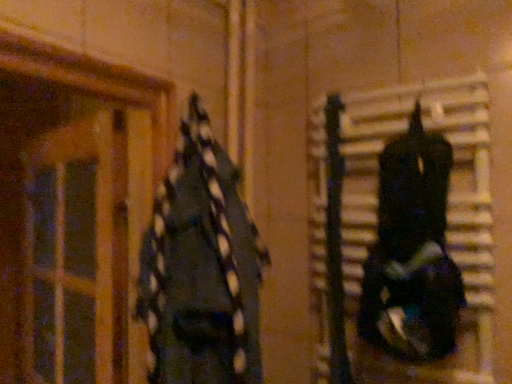
Question: From the image's perspective, is translucent wooden door at left on top of shiny black helmet at right, the second clothing positioned from the left?

Choices:
 (A) no
 (B) yes

Answer: (A)

Question: Is translucent wooden door at left further to camera compared to shiny black helmet at right, marked as the 1th clothing in a right-to-left arrangement?

Choices:
 (A) no
 (B) yes

Answer: (B)

Question: Would you say translucent wooden door at left is a long distance from shiny black helmet at right, the second clothing positioned from the left?

Choices:
 (A) no
 (B) yes

Answer: (A)

Question: Is translucent wooden door at left facing towards shiny black helmet at right, marked as the 1th clothing in a right-to-left arrangement?

Choices:
 (A) no
 (B) yes

Answer: (A)

Question: Is shiny black helmet at right, marked as the 1th clothing in a right-to-left arrangement, a part of translucent wooden door at left?

Choices:
 (A) no
 (B) yes

Answer: (A)

Question: Which is correct: shiny black helmet at right, the second clothing positioned from the left, is inside translucent wooden door at left, or outside of it?

Choices:
 (A) outside
 (B) inside

Answer: (A)

Question: Considering their positions, is shiny black helmet at right, the second clothing positioned from the left, located in front of or behind translucent wooden door at left?

Choices:
 (A) behind
 (B) front

Answer: (B)

Question: From the image's perspective, relative to translucent wooden door at left, is shiny black helmet at right, marked as the 1th clothing in a right-to-left arrangement, above or below?

Choices:
 (A) above
 (B) below

Answer: (A)

Question: Looking at the image, does shiny black helmet at right, the second clothing positioned from the left, seem bigger or smaller compared to translucent wooden door at left?

Choices:
 (A) small
 (B) big

Answer: (A)

Question: Is shiny black helmet at right, the second clothing positioned from the left, bigger or smaller than dark blue fabric at left, which is the 2th clothing in right-to-left order?

Choices:
 (A) small
 (B) big

Answer: (A)

Question: From the image's perspective, is shiny black helmet at right, the second clothing positioned from the left, positioned above or below dark blue fabric at left, which is the 2th clothing in right-to-left order?

Choices:
 (A) above
 (B) below

Answer: (A)

Question: Considering the positions of point (373, 339) and point (251, 354), is point (373, 339) closer or farther from the camera than point (251, 354)?

Choices:
 (A) farther
 (B) closer

Answer: (B)

Question: Is shiny black helmet at right, the second clothing positioned from the left, inside or outside of dark blue fabric at left, marked as the 1th clothing in a left-to-right arrangement?

Choices:
 (A) outside
 (B) inside

Answer: (A)

Question: Is point (28, 344) closer or farther from the camera than point (382, 218)?

Choices:
 (A) farther
 (B) closer

Answer: (A)

Question: In terms of size, does translucent wooden door at left appear bigger or smaller than shiny black helmet at right, marked as the 1th clothing in a right-to-left arrangement?

Choices:
 (A) big
 (B) small

Answer: (A)